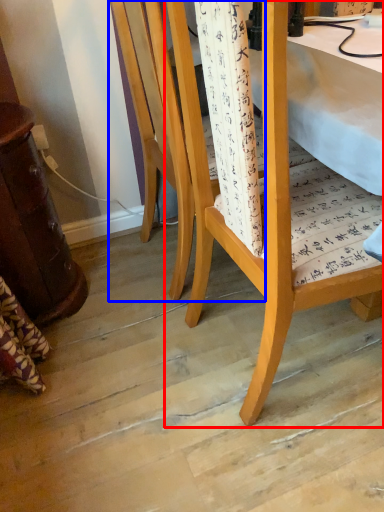
Question: Among these objects, which one is farthest to the camera, chair (highlighted by a red box) or chair (highlighted by a blue box)?

Choices:
 (A) chair
 (B) chair

Answer: (B)